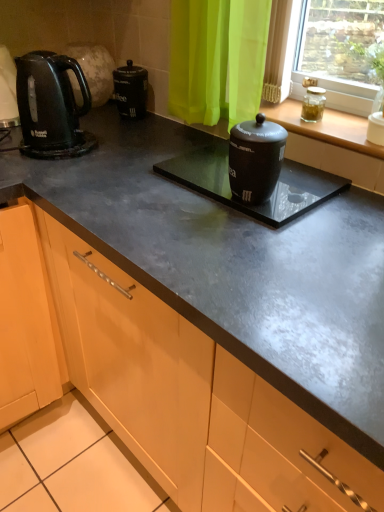
I want to click on empty space that is to the right of matte black kettle at left, so click(x=129, y=141).